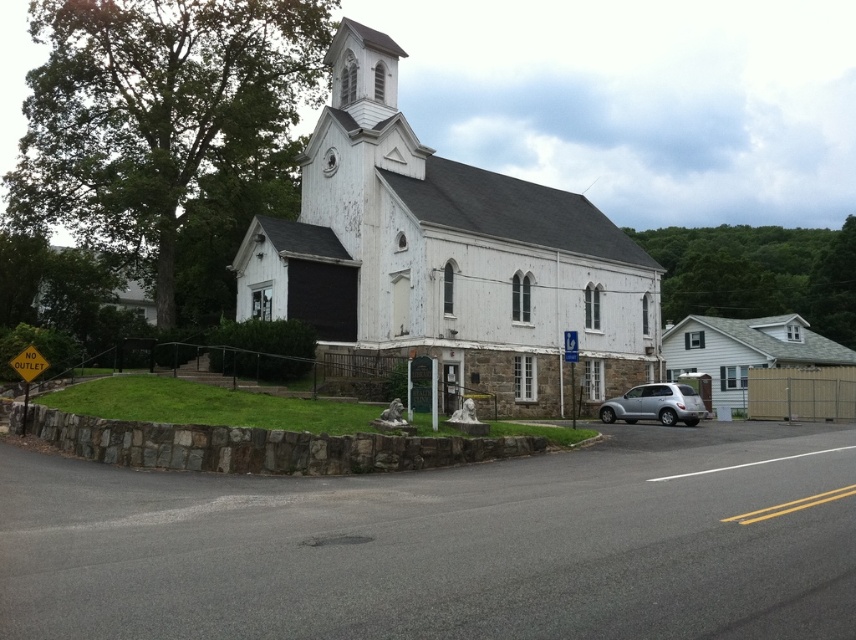
Who is taller, white wooden church at center or silver metallic suv at lower right?

Standing taller between the two is white wooden church at center.

Who is positioned more to the right, white wooden church at center or silver metallic suv at lower right?

silver metallic suv at lower right is more to the right.

Who is more distant from viewer, (642, 328) or (687, 403)?

Point (642, 328)

Find the location of a particular element. white wooden church at center is located at coordinates (446, 257).